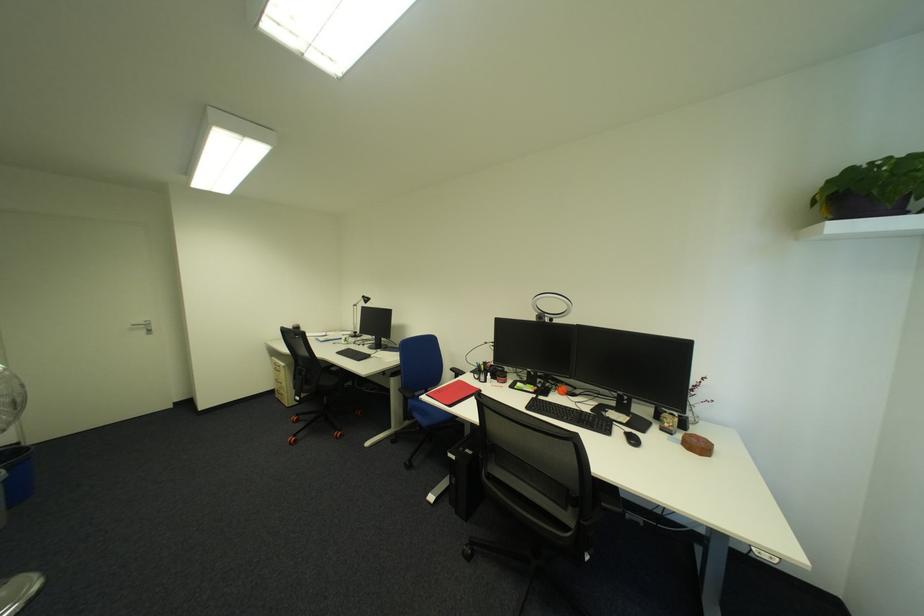
Identify the location of computer mouse. The image size is (924, 616). point(631,439).